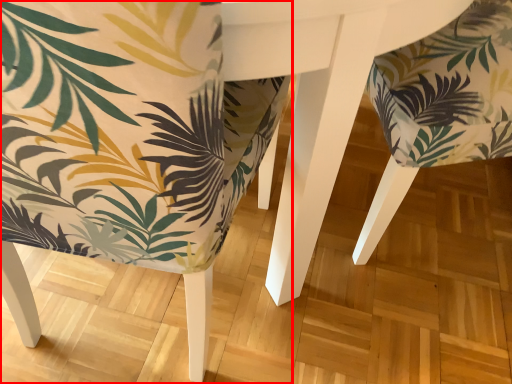
Question: From the image's perspective, what is the correct spatial relationship of chair (annotated by the red box) in relation to chair?

Choices:
 (A) above
 (B) below

Answer: (B)